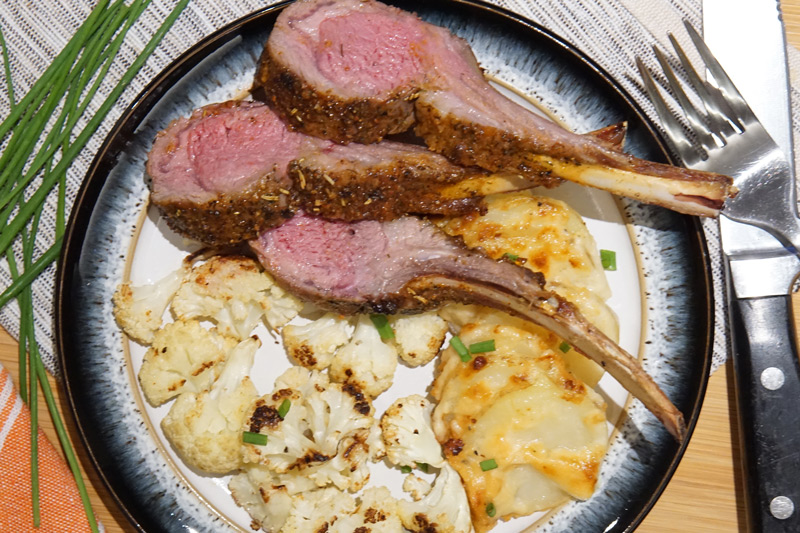
The image size is (800, 533). Identify the location of table. (714, 463).